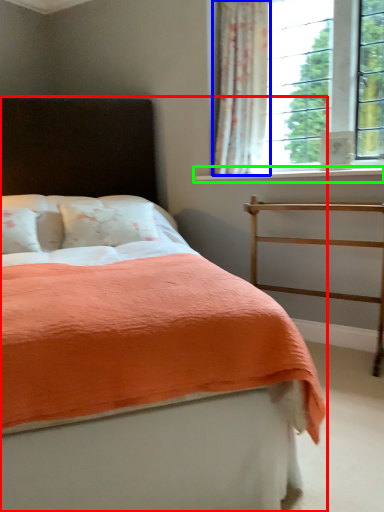
Question: Based on their relative distances, which object is nearer to bed (highlighted by a red box)? Choose from curtain (highlighted by a blue box) and window sill (highlighted by a green box).

Choices:
 (A) curtain
 (B) window sill

Answer: (B)